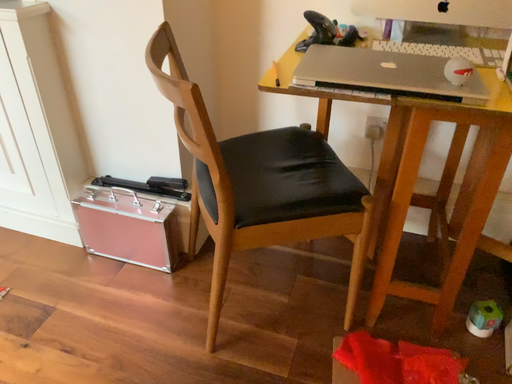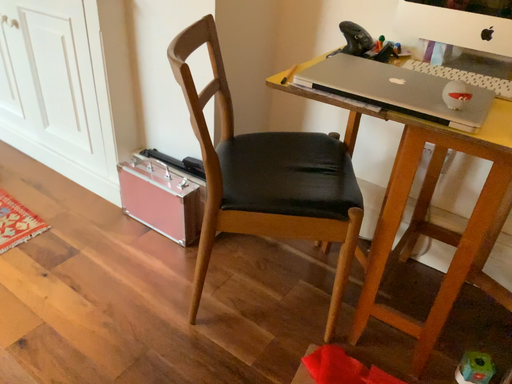
Question: Which way did the camera rotate in the video?

Choices:
 (A) rotated left
 (B) rotated right

Answer: (A)